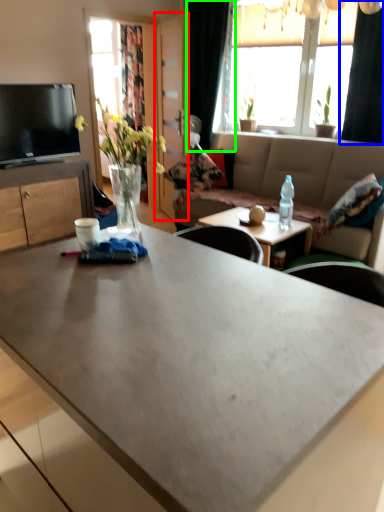
Question: Which object is positioned farthest from glass door (highlighted by a red box)? Select from curtain (highlighted by a blue box) and curtain (highlighted by a green box).

Choices:
 (A) curtain
 (B) curtain

Answer: (A)